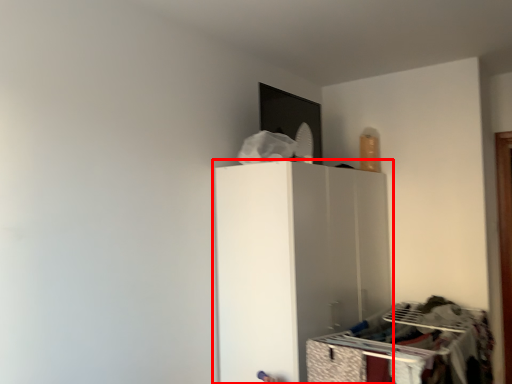
Question: Observing the image, what is the correct spatial positioning of furniture (annotated by the red box) in reference to drawer?

Choices:
 (A) right
 (B) left

Answer: (A)